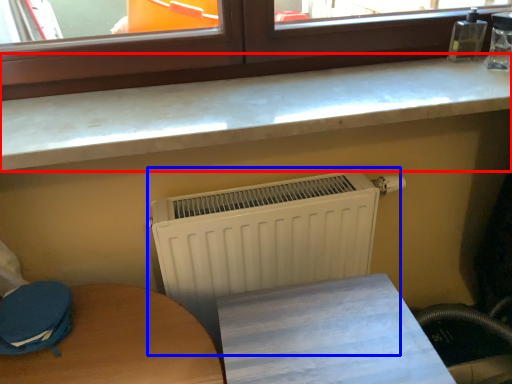
Question: Which of the following is the closest to the observer, countertop (highlighted by a red box) or radiator (highlighted by a blue box)?

Choices:
 (A) countertop
 (B) radiator

Answer: (A)